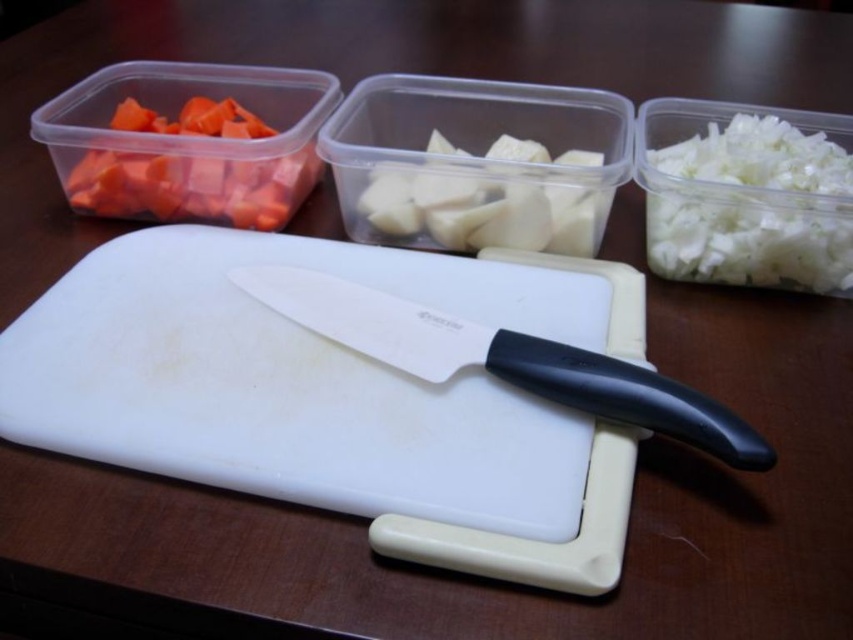
Is orange matte carrot at upper left further to camera compared to white matte potato at center?

That is True.

Who is higher up, orange matte carrot at upper left or white matte potato at center?

orange matte carrot at upper left is above.

Locate an element on the screen. orange matte carrot at upper left is located at coordinates (192, 186).

Find the location of a particular element. The width and height of the screenshot is (853, 640). orange matte carrot at upper left is located at coordinates pos(192,186).

Is point (737, 150) more distant than point (276, 298)?

Yes, point (737, 150) is farther from viewer.

Between white shredded onion at right and black plastic knife at center, which one is positioned higher?

white shredded onion at right

Locate an element on the screen. The image size is (853, 640). white shredded onion at right is located at coordinates (746, 195).

This screenshot has width=853, height=640. Describe the element at coordinates (339, 396) in the screenshot. I see `white plastic cutting board at center` at that location.

Measure the distance between point (x=462, y=276) and camera.

Point (x=462, y=276) and camera are 26.36 inches apart from each other.

Locate an element on the screen. This screenshot has height=640, width=853. white plastic cutting board at center is located at coordinates (339, 396).